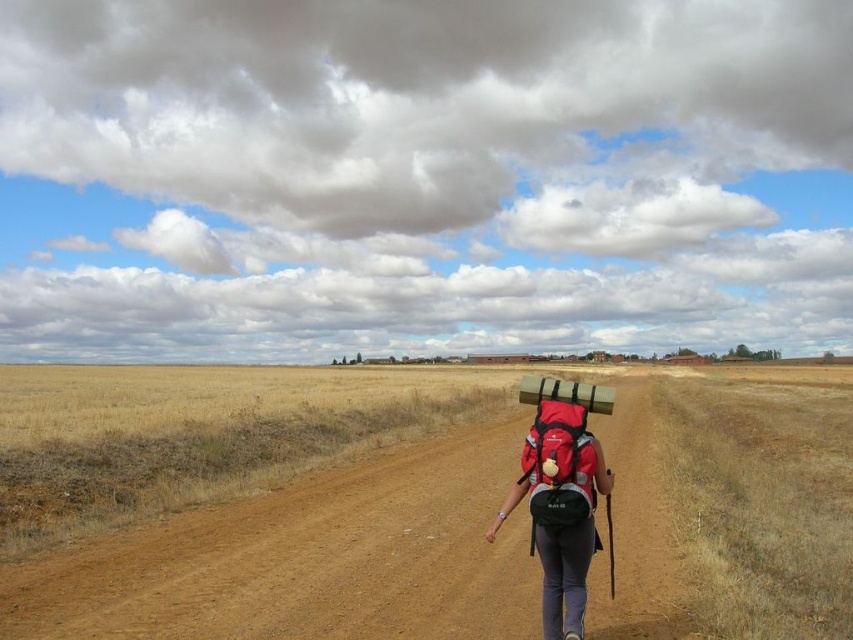
Which is below, brown dirt track at center or matte red backpack at center?

Positioned lower is brown dirt track at center.

Who is more distant from viewer, [479,532] or [582,461]?

The point [479,532] is more distant.

Which is in front, point (648, 611) or point (567, 433)?

Positioned in front is point (567, 433).

This screenshot has width=853, height=640. I want to click on brown dirt track at center, so click(308, 557).

Who is higher up, brown dirt track at center or red matte backpack at center?

red matte backpack at center is above.

Identify the location of brown dirt track at center. click(x=308, y=557).

Is point (492, 481) closer to viewer compared to point (570, 580)?

No, it is not.

What are the coordinates of `brown dirt track at center` in the screenshot? It's located at (308, 557).

Who is taller, red matte backpack at center or matte red backpack at center?

red matte backpack at center

Is point (550, 609) positioned behind point (553, 465)?

Yes, point (550, 609) is behind point (553, 465).

Is point (556, 412) more distant than point (543, 524)?

Yes, point (556, 412) is farther from viewer.

This screenshot has width=853, height=640. Find the location of `red matte backpack at center`. red matte backpack at center is located at coordinates (561, 497).